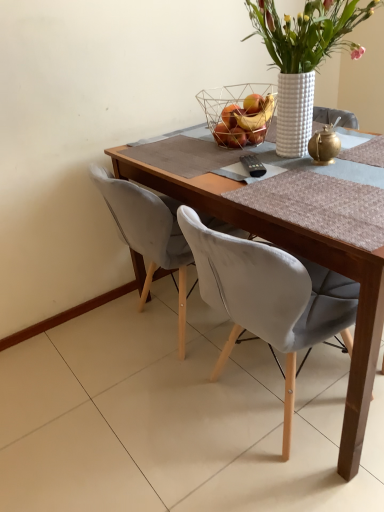
Question: Considering the relative positions of wooden table at center and white textured vase at upper center in the image provided, is wooden table at center to the left of white textured vase at upper center from the viewer's perspective?

Choices:
 (A) yes
 (B) no

Answer: (A)

Question: From the image's perspective, would you say wooden table at center is positioned over white textured vase at upper center?

Choices:
 (A) yes
 (B) no

Answer: (B)

Question: Considering the relative sizes of wooden table at center and white textured vase at upper center in the image provided, is wooden table at center thinner than white textured vase at upper center?

Choices:
 (A) no
 (B) yes

Answer: (A)

Question: From the image's perspective, does wooden table at center appear lower than white textured vase at upper center?

Choices:
 (A) yes
 (B) no

Answer: (A)

Question: Is wooden table at center far away from white textured vase at upper center?

Choices:
 (A) yes
 (B) no

Answer: (B)

Question: From a real-world perspective, is velvet grey chair at center above or below white textured vase at upper center?

Choices:
 (A) above
 (B) below

Answer: (B)

Question: Is velvet grey chair at center in front of or behind white textured vase at upper center in the image?

Choices:
 (A) behind
 (B) front

Answer: (A)

Question: In terms of width, does velvet grey chair at center look wider or thinner when compared to white textured vase at upper center?

Choices:
 (A) wide
 (B) thin

Answer: (A)

Question: Is velvet grey chair at center to the left or to the right of white textured vase at upper center in the image?

Choices:
 (A) right
 (B) left

Answer: (B)

Question: From the image's perspective, is wire mesh basket at upper center located above or below gold metallic teapot at upper right?

Choices:
 (A) above
 (B) below

Answer: (A)

Question: In the image, is wire mesh basket at upper center on the left side or the right side of gold metallic teapot at upper right?

Choices:
 (A) right
 (B) left

Answer: (B)

Question: In terms of size, does wire mesh basket at upper center appear bigger or smaller than gold metallic teapot at upper right?

Choices:
 (A) big
 (B) small

Answer: (A)

Question: In terms of width, does wire mesh basket at upper center look wider or thinner when compared to gold metallic teapot at upper right?

Choices:
 (A) wide
 (B) thin

Answer: (A)

Question: In terms of height, does gold metallic teapot at upper right look taller or shorter compared to velvet grey chair at center?

Choices:
 (A) short
 (B) tall

Answer: (A)

Question: Do you think gold metallic teapot at upper right is within velvet grey chair at center, or outside of it?

Choices:
 (A) inside
 (B) outside

Answer: (B)